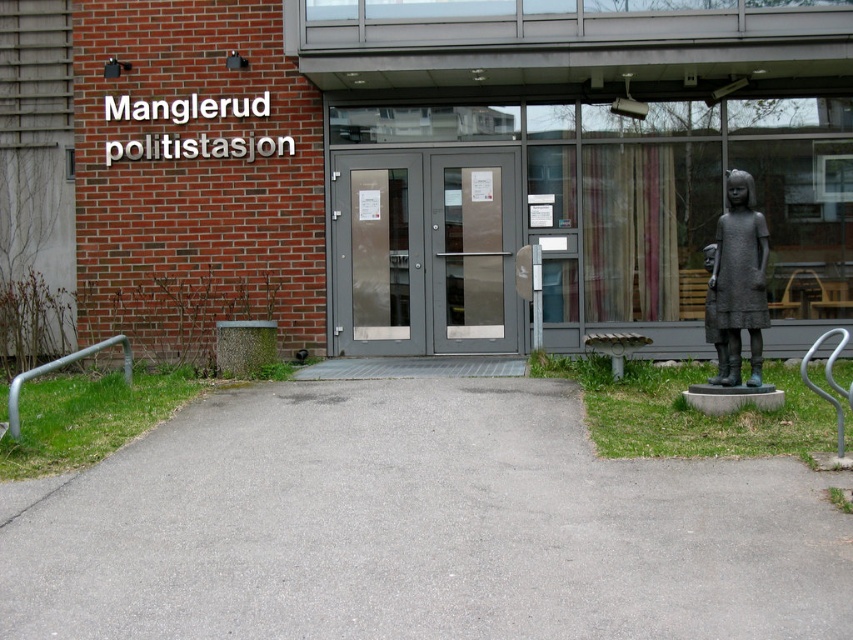
Question: Does matte gray doors at center have a larger size compared to bronze statue at right?

Choices:
 (A) no
 (B) yes

Answer: (B)

Question: Among these points, which one is farthest from the camera?

Choices:
 (A) (738, 282)
 (B) (503, 280)

Answer: (B)

Question: Can you confirm if matte gray doors at center is thinner than bronze statue at right?

Choices:
 (A) no
 (B) yes

Answer: (A)

Question: Can you confirm if matte gray doors at center is positioned to the left of bronze statue at right?

Choices:
 (A) yes
 (B) no

Answer: (A)